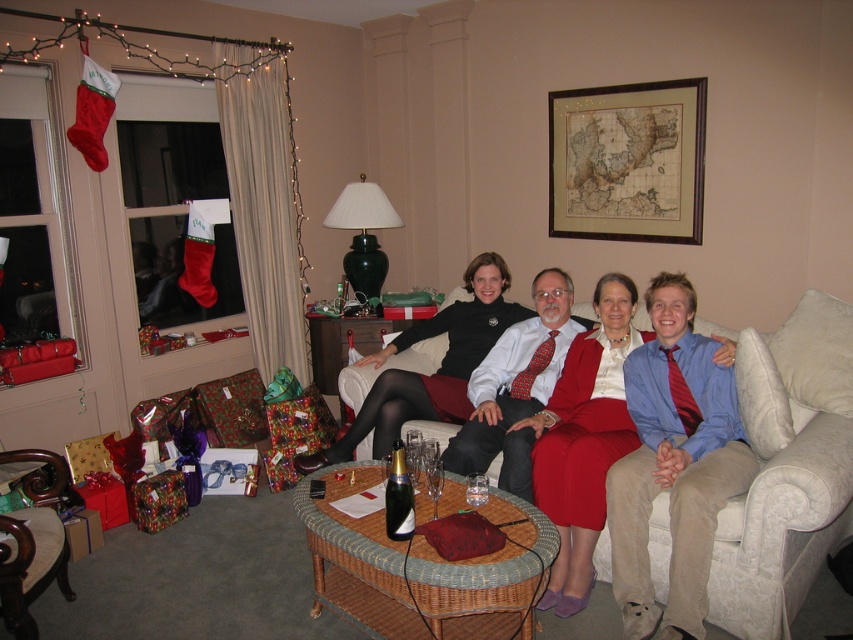
Question: Does matte black dress at center appear over transparent glass wine glass at center?

Choices:
 (A) yes
 (B) no

Answer: (A)

Question: Which of the following is the farthest from the observer?

Choices:
 (A) matte black sweater at center
 (B) matte black dress at center

Answer: (A)

Question: Which point appears farthest from the camera in this image?

Choices:
 (A) [502, 300]
 (B) [407, 476]
 (C) [12, 634]
 (D) [428, 476]

Answer: (A)

Question: Is dark wood armchair at lower left below transparent glass wine glass at center?

Choices:
 (A) no
 (B) yes

Answer: (B)

Question: Which object is the closest to the velvet white couch at center?

Choices:
 (A) dark wood armchair at lower left
 (B) matte black dress at center
 (C) matte black sweater at center
 (D) transparent glass wine glass at center

Answer: (B)

Question: Is matte black dress at center below transparent glass wine glass at center?

Choices:
 (A) no
 (B) yes

Answer: (A)